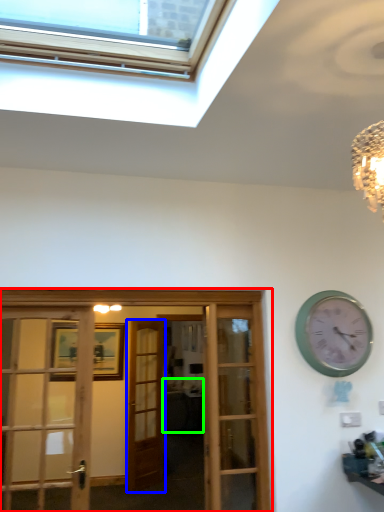
Question: Estimate the real-world distances between objects in this image. Which object is farther from hotel lobby (highlighted by a red box), door (highlighted by a blue box) or studio couch (highlighted by a green box)?

Choices:
 (A) door
 (B) studio couch

Answer: (B)